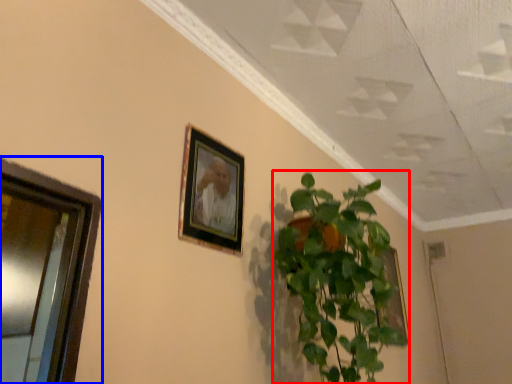
Question: Which object appears closest to the camera in this image, houseplant (highlighted by a red box) or window (highlighted by a blue box)?

Choices:
 (A) houseplant
 (B) window

Answer: (B)